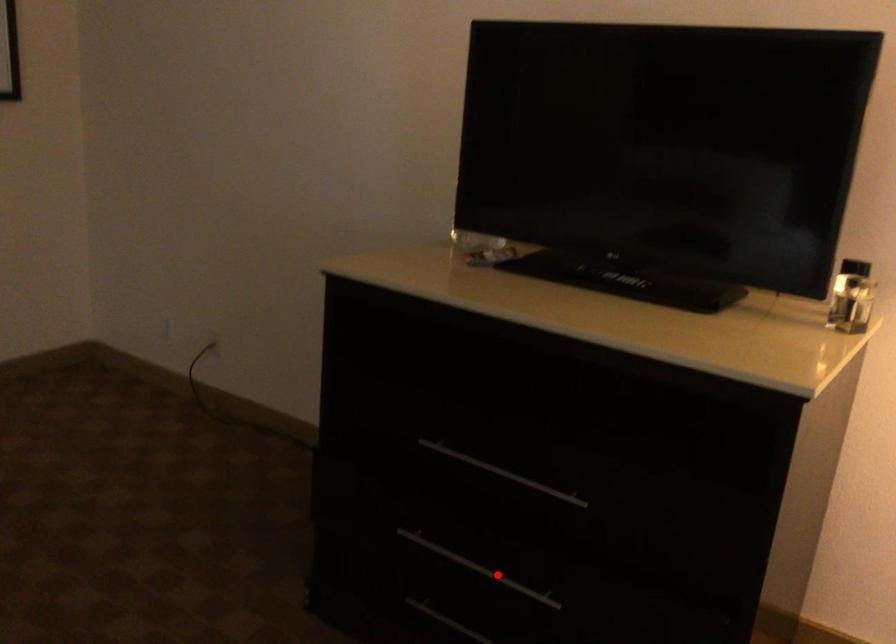
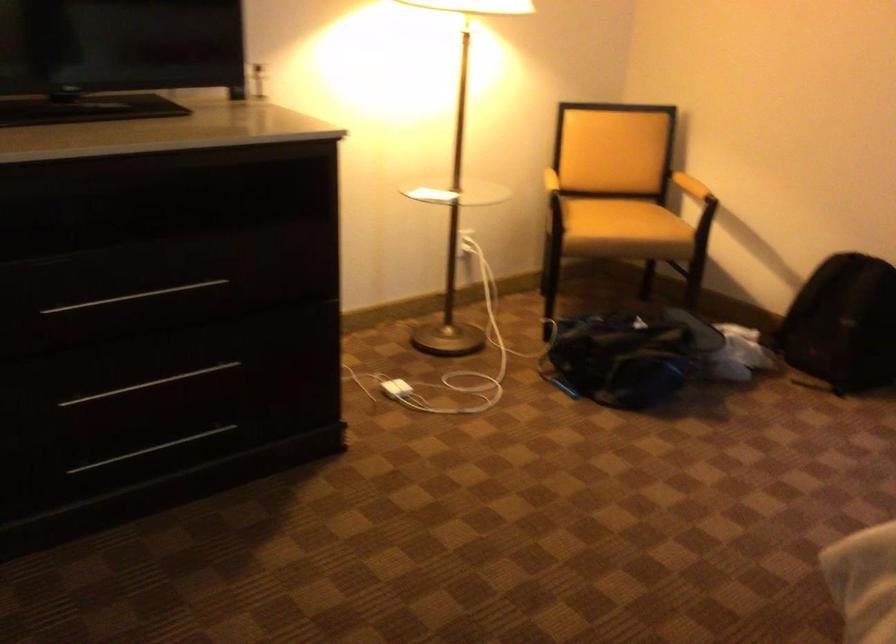
Locate, in the second image, the point that corresponds to the highlighted location in the first image.

(149, 384)